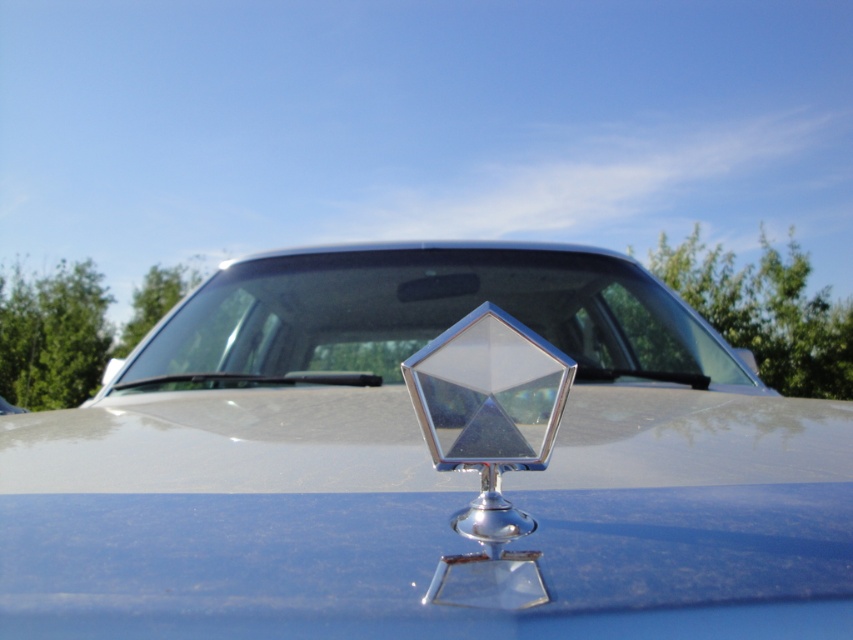
Is shiny chrome emblem at center above transparent glass windshield at center?

Actually, shiny chrome emblem at center is below transparent glass windshield at center.

What do you see at coordinates (428, 465) in the screenshot? The height and width of the screenshot is (640, 853). I see `shiny chrome emblem at center` at bounding box center [428, 465].

Image resolution: width=853 pixels, height=640 pixels. In order to click on shiny chrome emblem at center in this screenshot , I will do `click(428, 465)`.